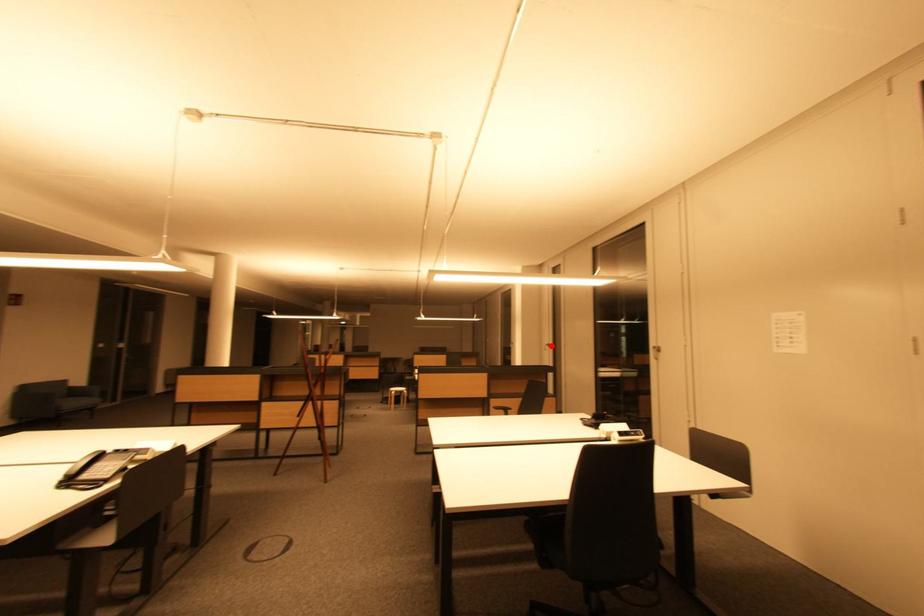
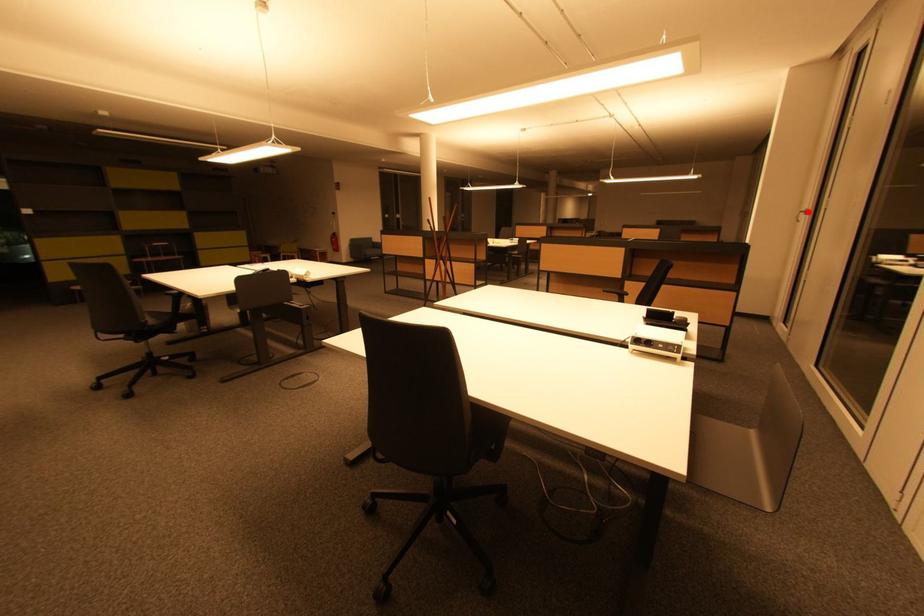
I am providing you with two images of the same scene from different viewpoints. A red point is marked on the first image and another point is marked on the second image. Does the point marked in image1 correspond to the same location as the one in image2?

Yes